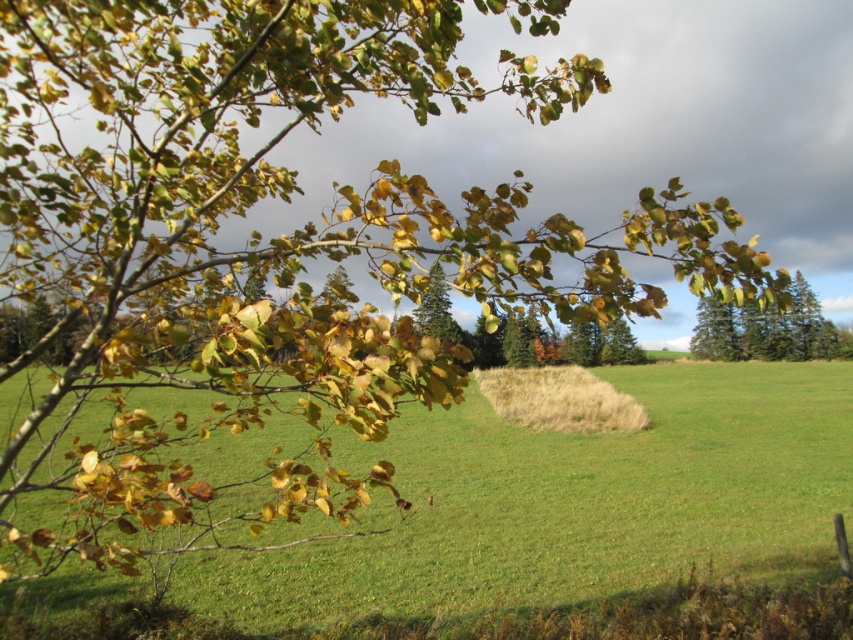
You are a gardener planning to plant new shrubs between the dry grass at center and the green matte tree at center. Based on their positions, which object should you start working closer to from the left side of the field?

The green matte tree at center is on the left side of the dry grass at center, so you should start working closer to the green matte tree at center from the left side of the field.

You are standing at the center of the field and want to walk towards the green grass pasture at lower left. Which direction should you face to head directly towards it?

You should face the lower left direction to head directly towards the green grass pasture at lower left since it is located at point (x=577, y=518) which is in the lower left area of the scene.